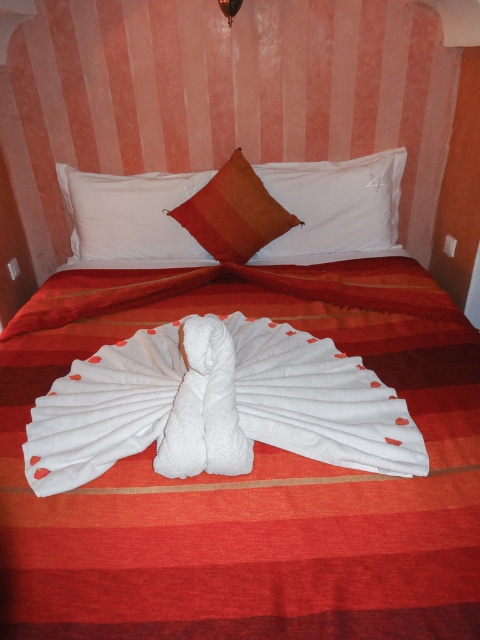
Is point (164, 465) positioned before point (355, 241)?

Yes, point (164, 465) is closer to viewer.

Can you confirm if white towel at center is taller than white soft pillow at upper center?

In fact, white towel at center may be shorter than white soft pillow at upper center.

Which is in front, point (162, 401) or point (122, 262)?

Point (162, 401)

Find the location of a particular element. The height and width of the screenshot is (640, 480). white towel at center is located at coordinates (216, 404).